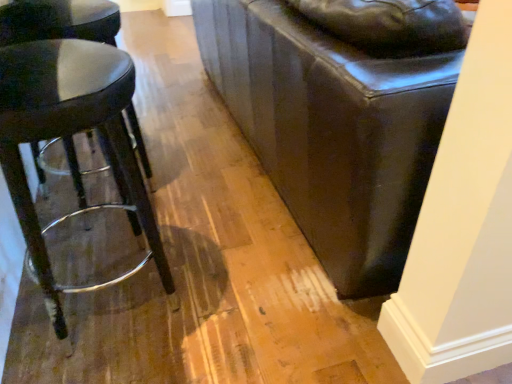
Locate an element on the screen. This screenshot has height=384, width=512. vacant space that is in between matte black stool at left, acting as the first stool starting from the back, and matte black stool at left, the second stool viewed from the back is located at coordinates (97, 243).